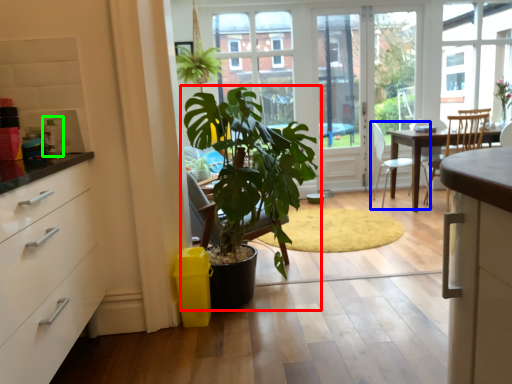
Question: Which object is the farthest from houseplant (highlighted by a red box)? Choose among these: chair (highlighted by a blue box) or appliance (highlighted by a green box).

Choices:
 (A) chair
 (B) appliance

Answer: (A)